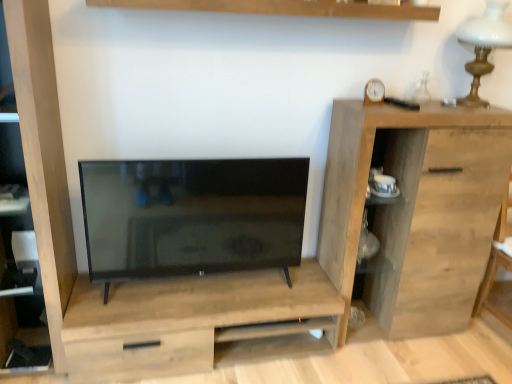
Locate an element on the screen. vacant area that is situated to the right of wooden clock at upper right is located at coordinates (415, 107).